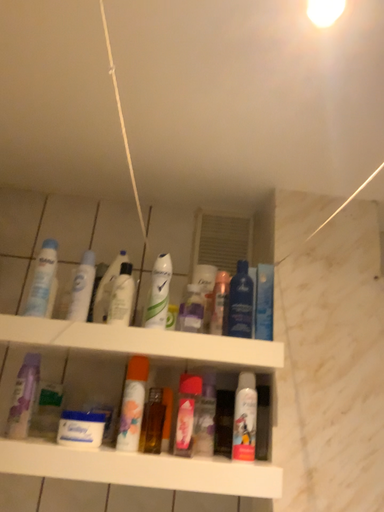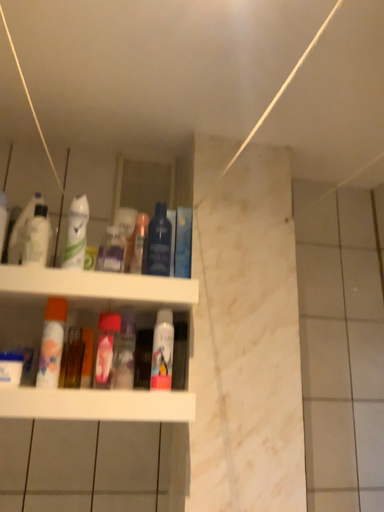
Question: How did the camera likely rotate when shooting the video?

Choices:
 (A) rotated left
 (B) rotated right

Answer: (B)